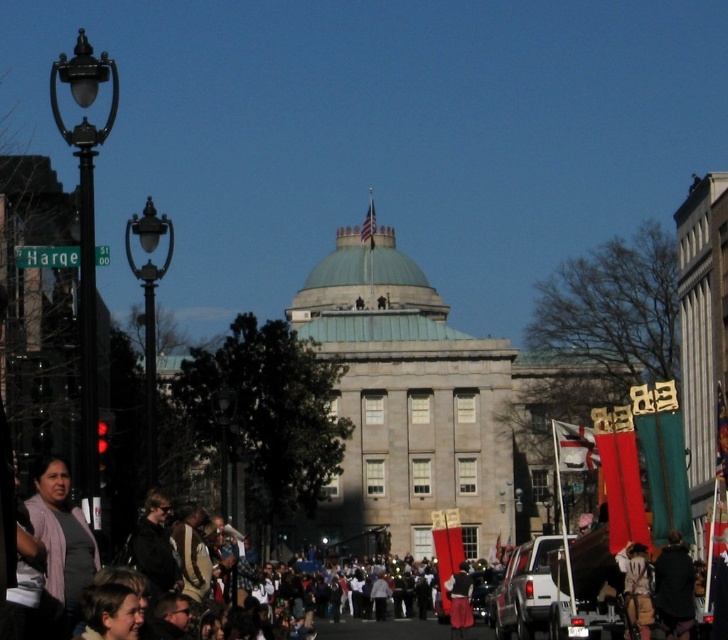
Based on the photo, you are a photographer trying to capture a photo of the crowd in front of the historic building. You notice two people in the crowd wearing a dark brown leather jacket at lower right and a red fabric skirt at center. Which clothing item takes up more space in the photo?

The red fabric skirt at center takes up more space in the photo because it has a greater width compared to the dark brown leather jacket at lower right.

You are a photographer standing in the middle of the street. You want to take a photo of the white matte truck at lower center and the light brown hair at lower left. Which object should you focus on first if you want to capture both in the same frame without moving your camera?

You should focus on the white matte truck at lower center first because it is much taller than the light brown hair at lower left, so adjusting the camera angle to include its height will naturally include the shorter object in the frame.

You are a photographer standing in front of the historic building with a neoclassical style. You notice two people in the crowd wearing a dark brown leather jacket at lower right and a red fabric skirt at center. Which clothing item is shorter in height?

The dark brown leather jacket at lower right is not as tall as the red fabric skirt at center, so the dark brown leather jacket at lower right is shorter in height.